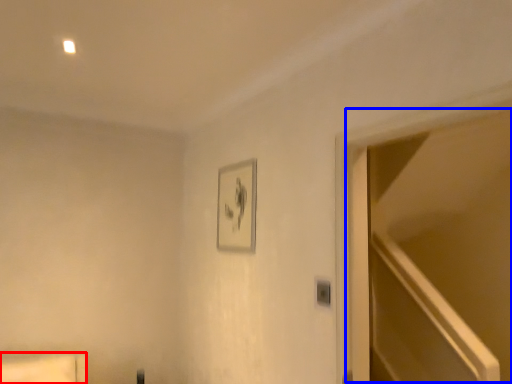
Question: Which point is closer to the camera, furniture (highlighted by a red box) or glass door (highlighted by a blue box)?

Choices:
 (A) furniture
 (B) glass door

Answer: (B)